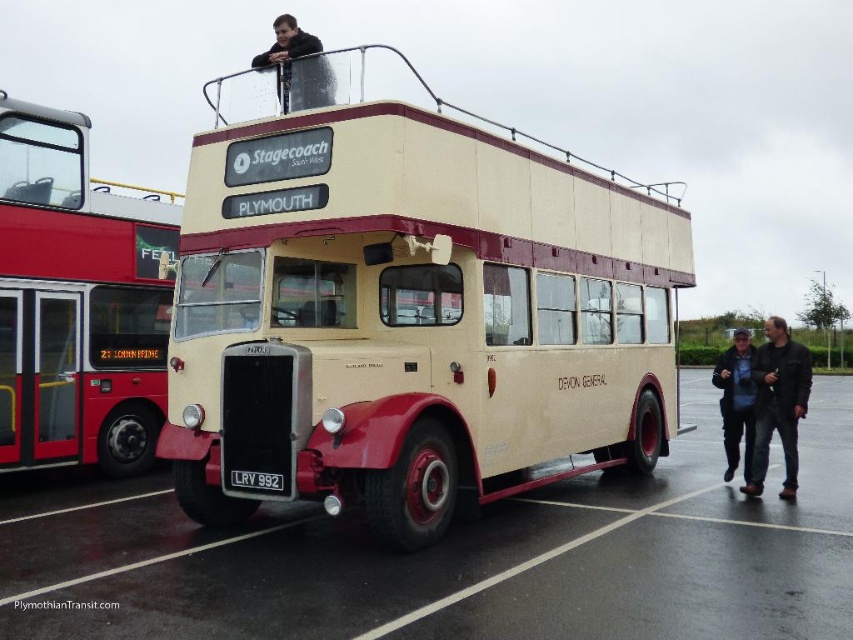
Does red metallic bus at left appear on the right side of black leather jacket at upper center?

Yes, red metallic bus at left is to the right of black leather jacket at upper center.

Is point (97, 268) in front of point (283, 28)?

No, it is not.

Where is `red metallic bus at left`? This screenshot has height=640, width=853. red metallic bus at left is located at coordinates (77, 301).

Does beige matte bus at center have a lesser height compared to beige rubber parking lot at center?

Incorrect, beige matte bus at center's height does not fall short of beige rubber parking lot at center's.

Between beige matte bus at center and beige rubber parking lot at center, which one is positioned lower?

beige rubber parking lot at center is below.

Is point (209, 216) behind point (834, 627)?

Yes, point (209, 216) is behind point (834, 627).

Where is `beige matte bus at center`? beige matte bus at center is located at coordinates (410, 316).

Is dark blue jacket at lower right to the left of black metal license plate at center from the viewer's perspective?

In fact, dark blue jacket at lower right is to the right of black metal license plate at center.

Who is more distant from viewer, (x=715, y=385) or (x=268, y=481)?

Positioned behind is point (x=715, y=385).

Describe the element at coordinates (735, 401) in the screenshot. The width and height of the screenshot is (853, 640). I see `dark blue jacket at lower right` at that location.

I want to click on dark blue jacket at lower right, so click(735, 401).